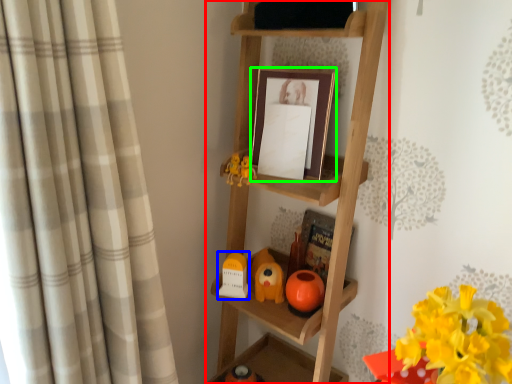
Question: Considering the real-world distances, which object is closest to shelf (highlighted by a red box)? toy (highlighted by a blue box) or picture frame (highlighted by a green box).

Choices:
 (A) toy
 (B) picture frame

Answer: (B)